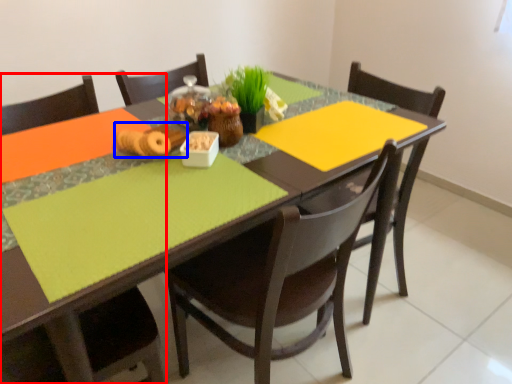
Question: Which point is closer to the camera, chair (highlighted by a red box) or food (highlighted by a blue box)?

Choices:
 (A) chair
 (B) food

Answer: (A)